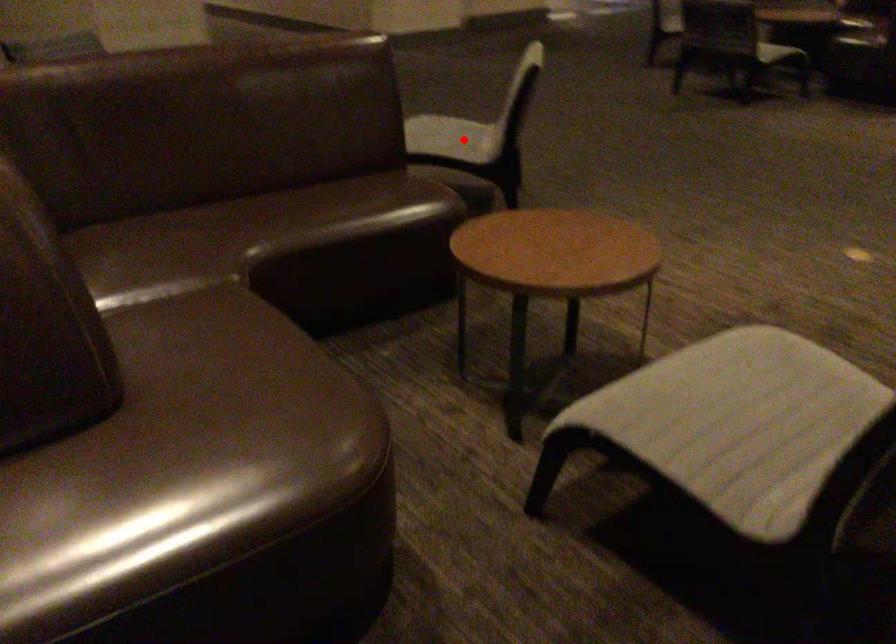
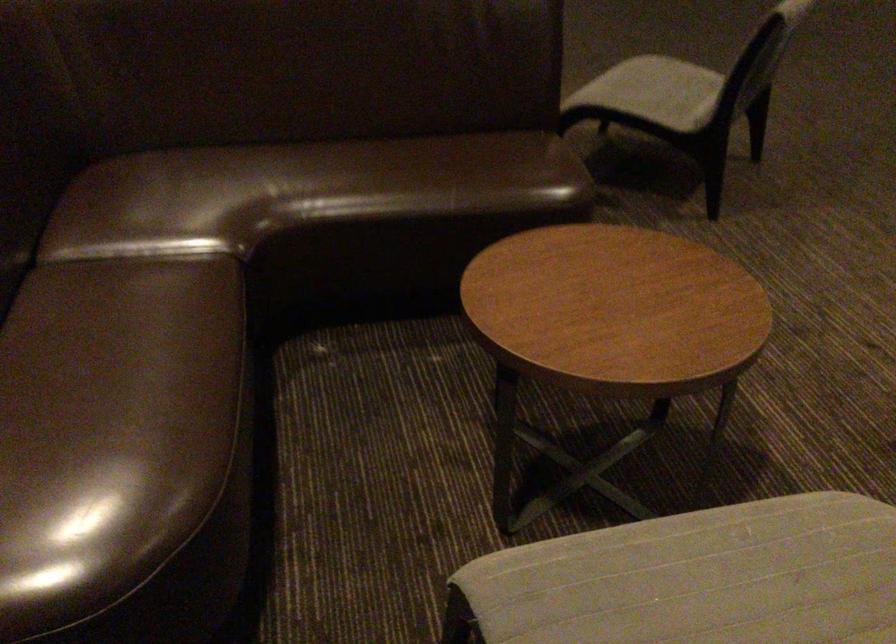
In the second image, find the point that corresponds to the highlighted location in the first image.

(655, 91)